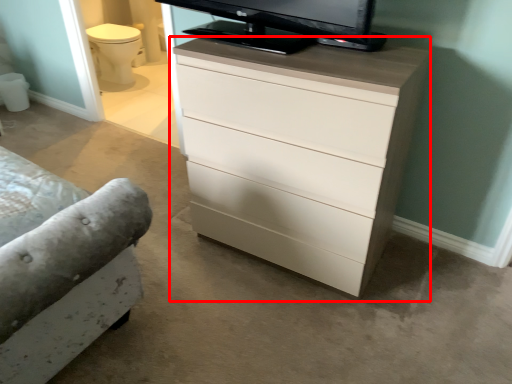
Question: From the image, what is the correct spatial relationship of chest of drawers (annotated by the red box) in relation to drawer?

Choices:
 (A) left
 (B) right

Answer: (A)